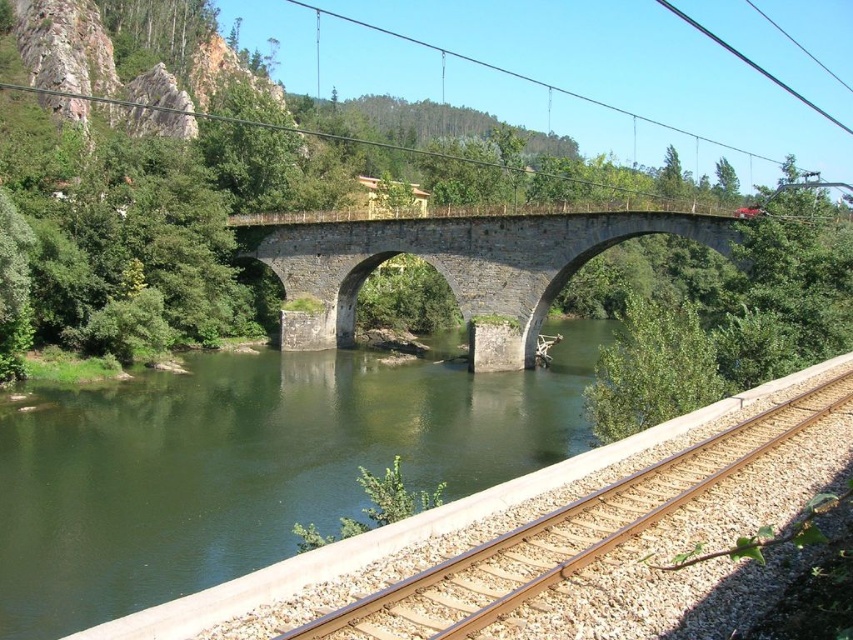
Consider the image. You are standing on the brown gravel track at lower right and want to cross the river. Is the stone arch bridge at center accessible from your current position? Explain why based on their positions.

The stone arch bridge at center is further to the viewer than the brown gravel track at lower right, meaning it is closer to you. Since you are on the track, you can easily walk towards the bridge to cross the river.

You are standing at the brown gravel track at lower right and want to cross the river. Which direction should you walk to reach the stone arch bridge at center?

You should walk to the left towards the stone arch bridge at center since it is located to the left of the brown gravel track at lower right.